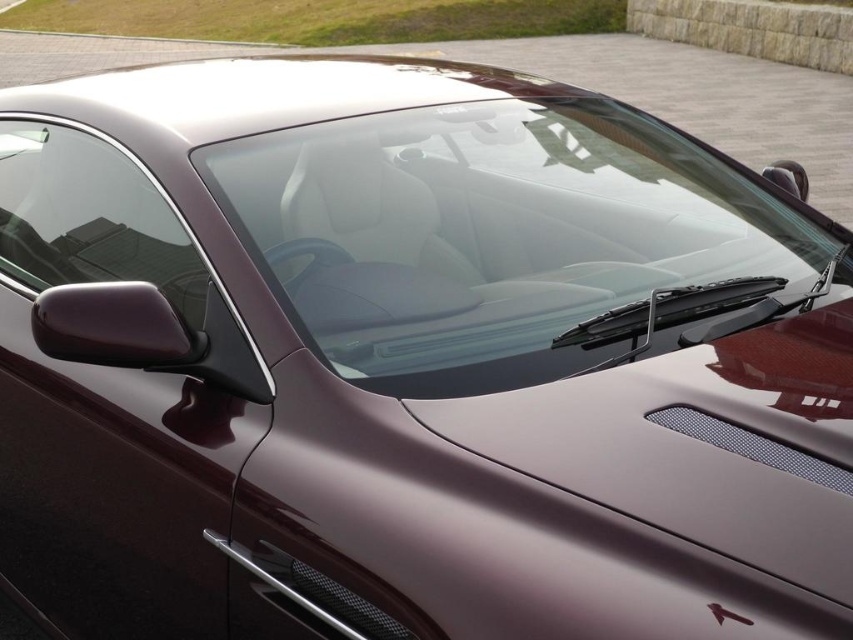
Question: Which point is closer to the camera taking this photo?

Choices:
 (A) (26, 166)
 (B) (80, 36)

Answer: (A)

Question: Does transparent glass windshield at center have a greater width compared to transparent glass windshield at upper left?

Choices:
 (A) yes
 (B) no

Answer: (A)

Question: Does transparent glass windshield at center come behind transparent glass windshield at upper left?

Choices:
 (A) no
 (B) yes

Answer: (A)

Question: Which object is the closest to the transparent glass windshield at upper left?

Choices:
 (A) glossy brown car at upper center
 (B) transparent glass windshield at center

Answer: (B)

Question: Which point appears closest to the camera in this image?

Choices:
 (A) (9, 186)
 (B) (740, 132)
 (C) (654, 188)

Answer: (C)

Question: Is transparent glass windshield at center bigger than glossy brown car at upper center?

Choices:
 (A) yes
 (B) no

Answer: (B)